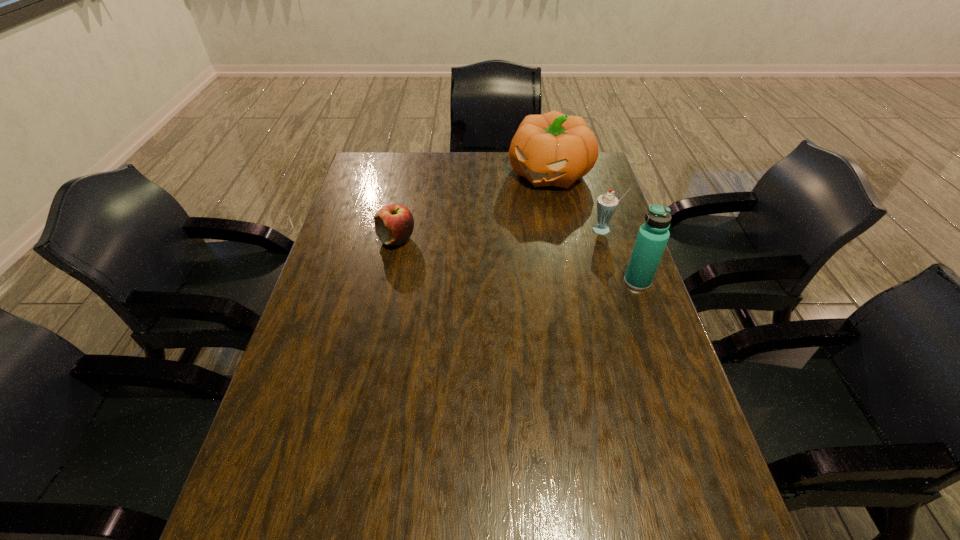
This screenshot has height=540, width=960. Find the location of `free space at the near edge of the desktop`. free space at the near edge of the desktop is located at coordinates (605, 459).

Identify the location of free space at the left edge. The height and width of the screenshot is (540, 960). (298, 375).

In the image, there is a desktop. Identify the location of free region at the right edge. Image resolution: width=960 pixels, height=540 pixels. (599, 342).

Locate an element on the screen. vacant region at the far left corner of the desktop is located at coordinates point(384,161).

Where is `free spot between the shortest object and the milkshake`? free spot between the shortest object and the milkshake is located at coordinates (500, 235).

I want to click on vacant point located between the nearest object and the milkshake, so click(x=620, y=255).

The image size is (960, 540). I want to click on vacant region between the leftmost object and the nearest object, so click(517, 260).

Where is `vacant area between the pumpkin and the thermos bottle`? The width and height of the screenshot is (960, 540). vacant area between the pumpkin and the thermos bottle is located at coordinates (593, 227).

Find the location of a particular element. This screenshot has height=540, width=960. empty space that is in between the second shortest object and the nearest object is located at coordinates (620, 255).

Identify the location of empty space that is in between the nearest object and the pumpkin. The width and height of the screenshot is (960, 540). (593, 227).